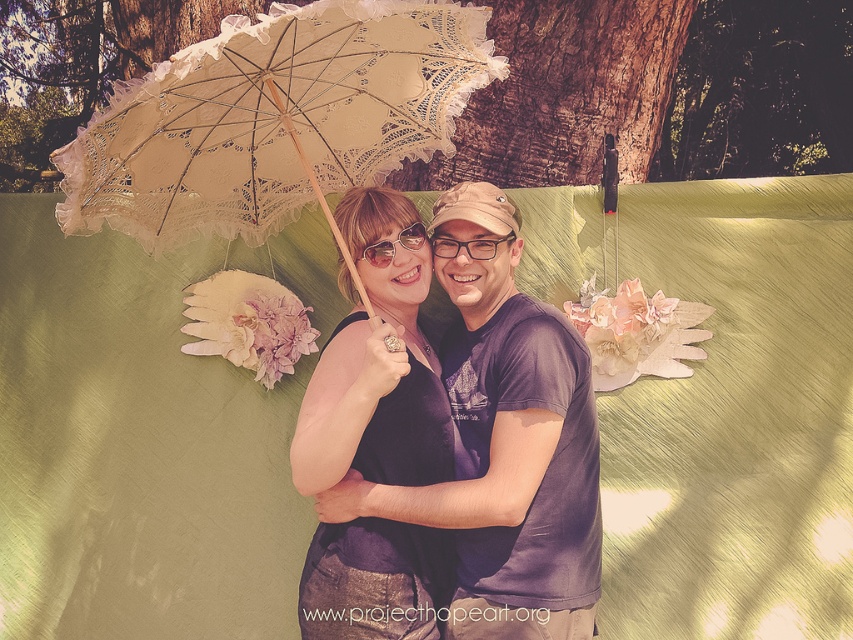
You are a photographer setting up a still life scene. You have two items, the matte black goggles at center and the clear plastic glasses at center. According to the scene description, which object is positioned higher?

The matte black goggles at center is located above the clear plastic glasses at center, so the matte black goggles at center is positioned higher.

You are an observer looking at the image. There is a brown textured tree trunk at upper center and a matte black goggles at center. Which object is positioned to the right of the other?

The matte black goggles at center are positioned to the right of the brown textured tree trunk at upper center.